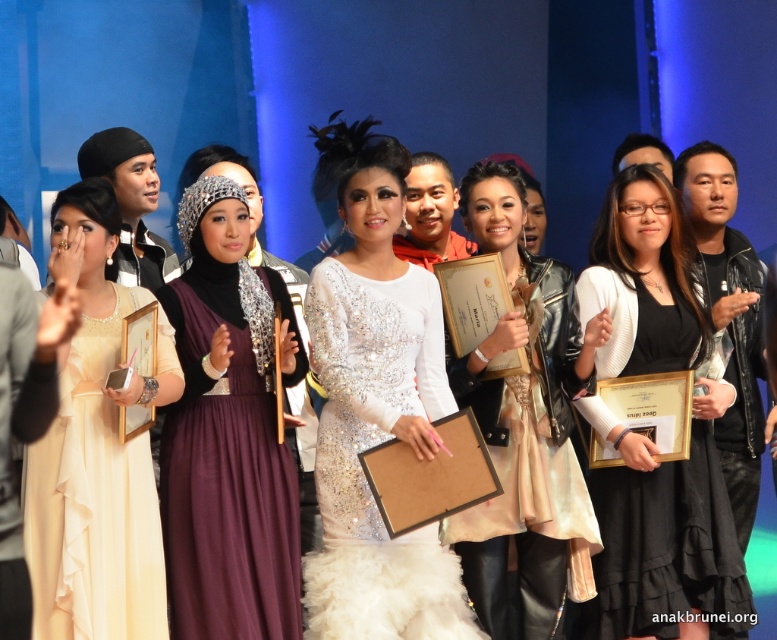
Is purple satin hijab at center smaller than ivory satin dress at left?

Yes.

Between purple satin hijab at center and ivory satin dress at left, which one is positioned lower?

purple satin hijab at center is lower down.

Between point (260, 563) and point (77, 202), which one is positioned behind?

The point (260, 563) is more distant.

Locate an element on the screen. This screenshot has width=777, height=640. purple satin hijab at center is located at coordinates (228, 435).

Can you confirm if white sequined dress at center is taller than black matte dress at center?

Indeed, white sequined dress at center has a greater height compared to black matte dress at center.

Locate an element on the screen. Image resolution: width=777 pixels, height=640 pixels. white sequined dress at center is located at coordinates (375, 406).

Find the location of a particular element. white sequined dress at center is located at coordinates (375, 406).

Who is higher up, white sequined dress at center or purple satin hijab at center?

white sequined dress at center

Does white sequined dress at center have a greater height compared to purple satin hijab at center?

Correct, white sequined dress at center is much taller as purple satin hijab at center.

Describe the element at coordinates (375, 406) in the screenshot. This screenshot has width=777, height=640. I see `white sequined dress at center` at that location.

In order to click on white sequined dress at center in this screenshot , I will do `click(375, 406)`.